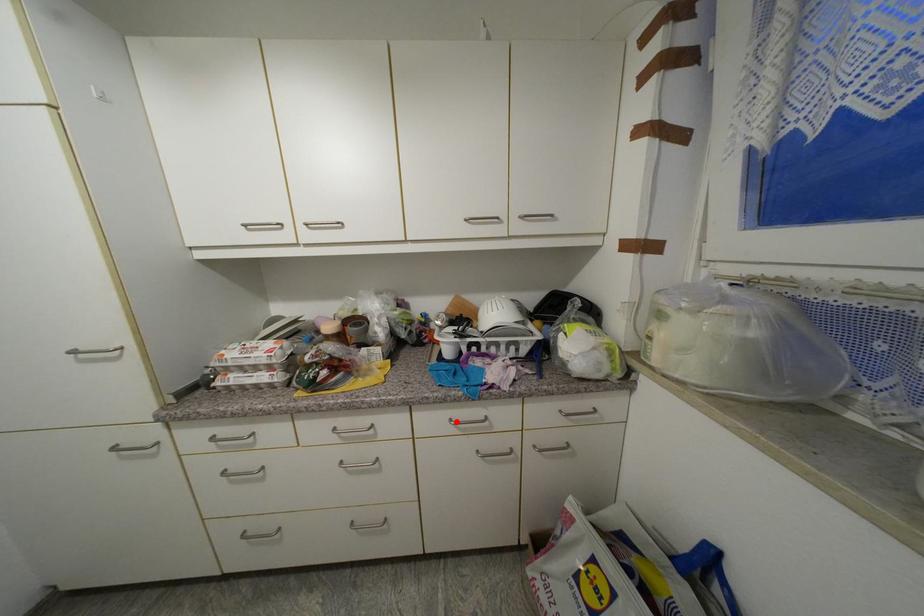
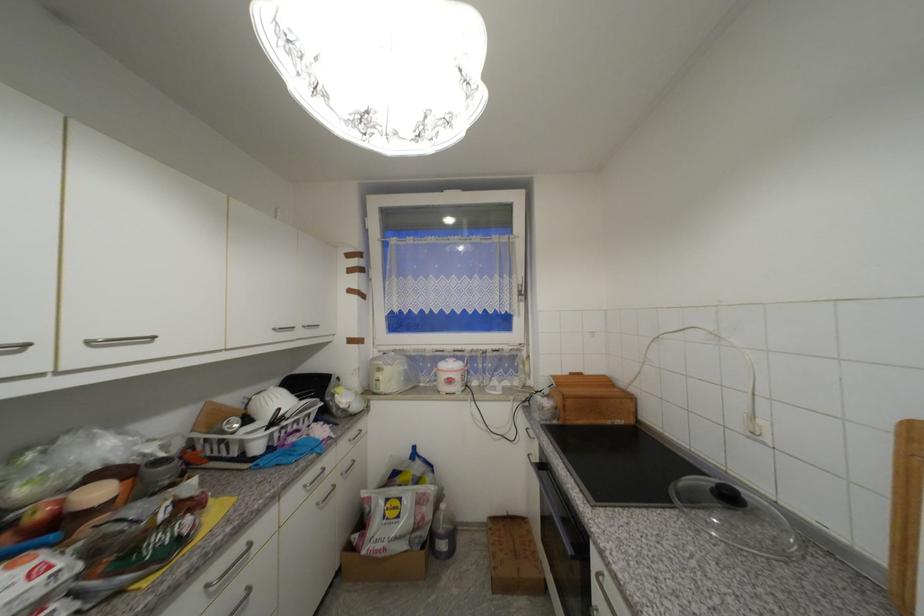
Question: I am providing you with two images of the same scene from different viewpoints. In image1, a red point is highlighted. Considering the same 3D point in image2, which of the following is correct?

Choices:
 (A) It is closer
 (B) It is farther

Answer: (A)